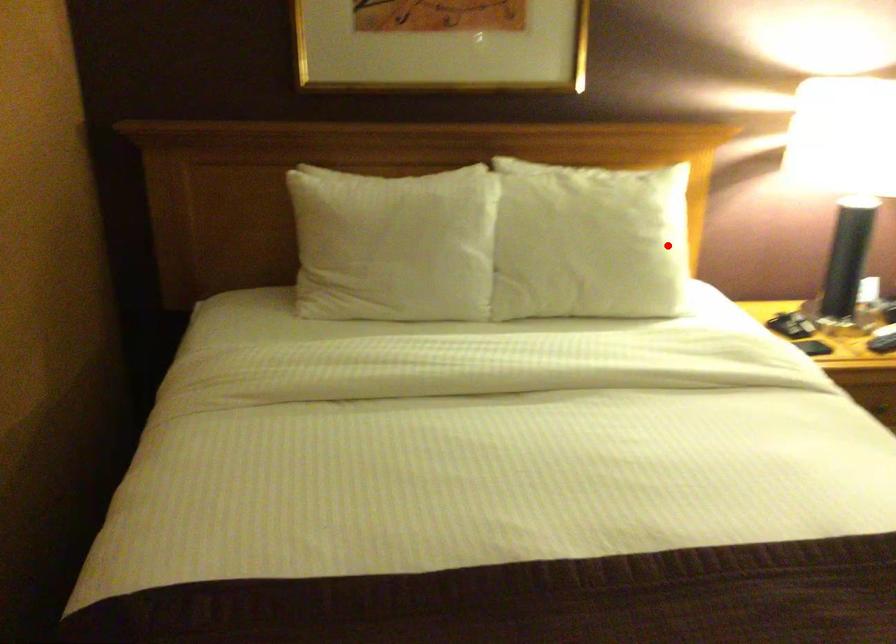
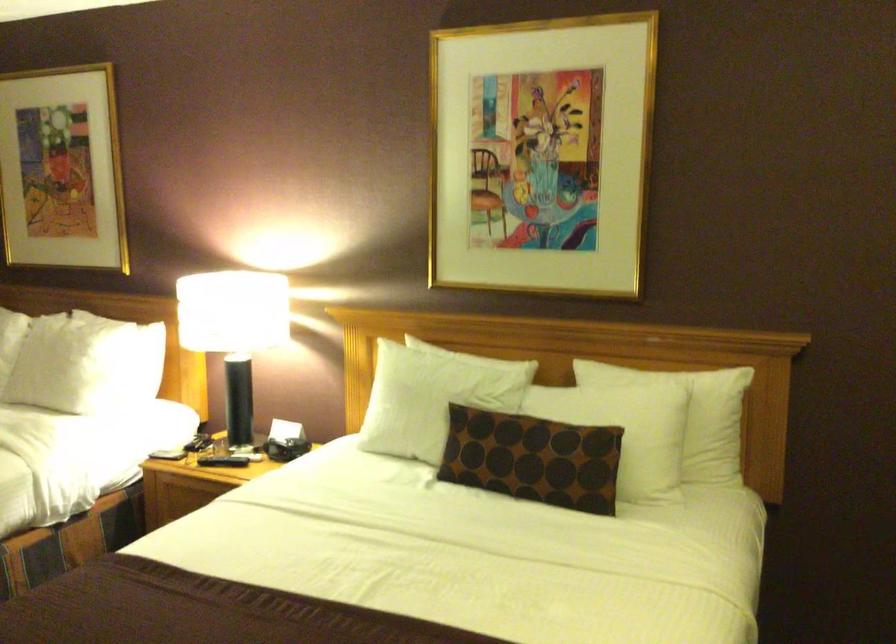
Question: I am providing you with two images of the same scene from different viewpoints. A red point is marked on the first image. Can you still see the location of the red point in image 2?

Choices:
 (A) Yes
 (B) No

Answer: (A)